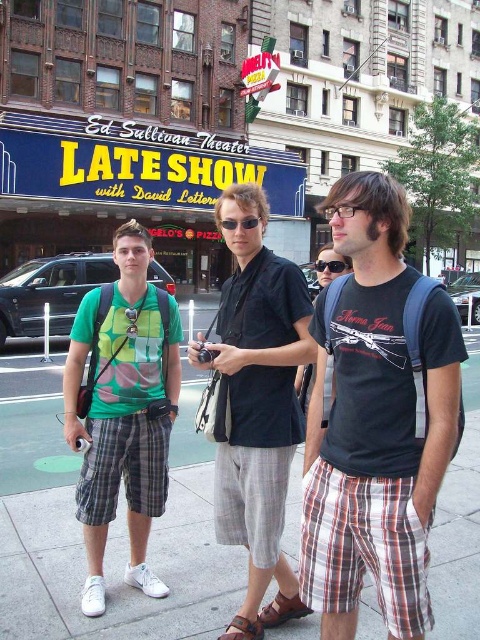
Locate an element on the screen. green matte t-shirt at left is located at coordinates (123, 410).

Is green matte t-shirt at left in front of black plastic goggles at center?

That is True.

Is point (159, 369) closer to viewer compared to point (334, 269)?

Yes.

The height and width of the screenshot is (640, 480). Identify the location of green matte t-shirt at left. (123, 410).

Is black cotton shirt at center to the left of black plastic goggles at center from the viewer's perspective?

Yes, black cotton shirt at center is to the left of black plastic goggles at center.

Who is lower down, black cotton shirt at center or black plastic goggles at center?

black cotton shirt at center is lower down.

Is point (280, 328) behind point (332, 260)?

That is False.

Identify the location of black cotton shirt at center. (257, 406).

Between black cotton shirt at center and black plastic sunglasses at center, which one is positioned higher?

black plastic sunglasses at center is above.

Who is shorter, black cotton shirt at center or black plastic sunglasses at center?

With less height is black plastic sunglasses at center.

Locate an element on the screen. black cotton shirt at center is located at coordinates (257, 406).